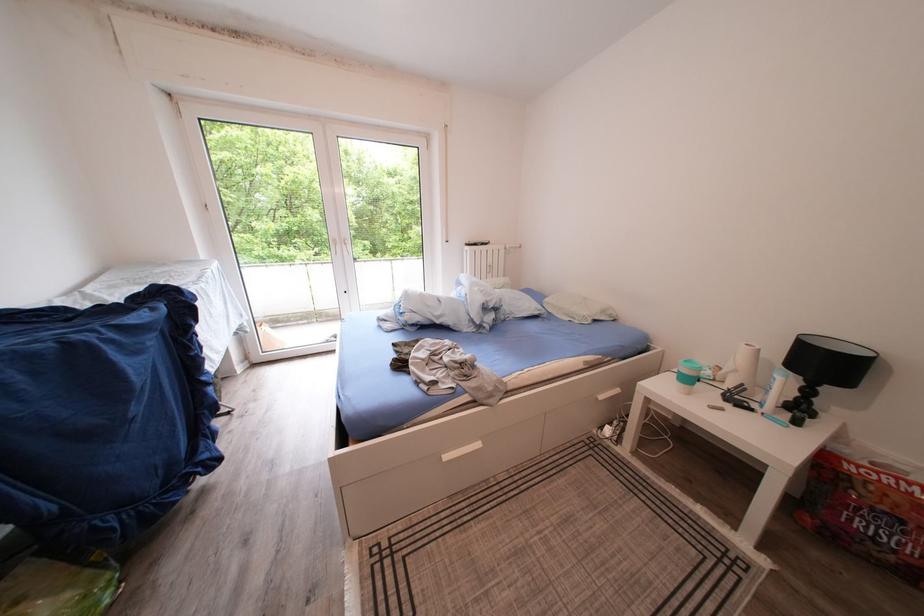
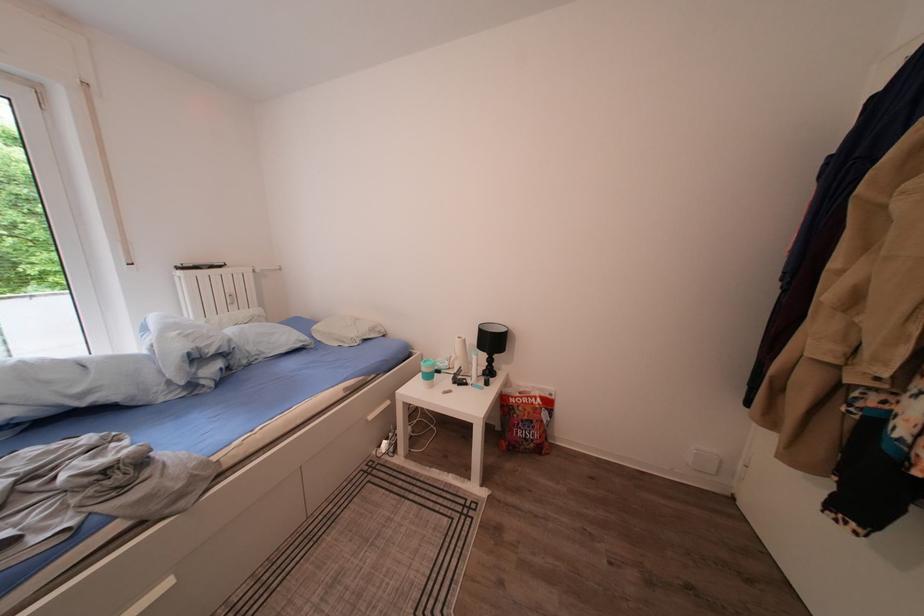
In the second image, find the point that corresponds to (836,371) in the first image.

(502, 347)